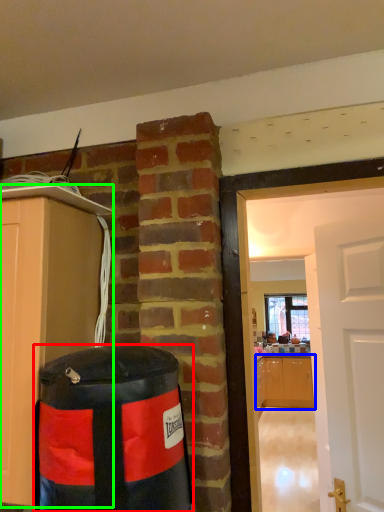
Question: Which object is the farthest from punching bag (highlighted by a red box)? Choose among these: cabinetry (highlighted by a blue box) or cabinetry (highlighted by a green box).

Choices:
 (A) cabinetry
 (B) cabinetry

Answer: (A)